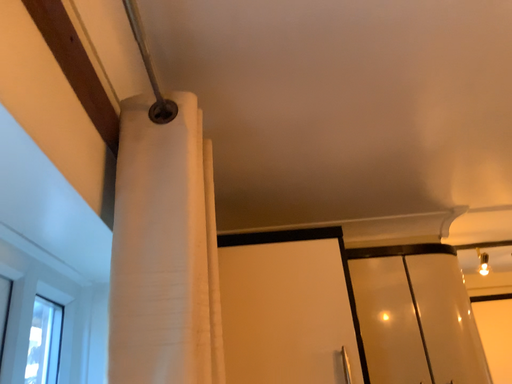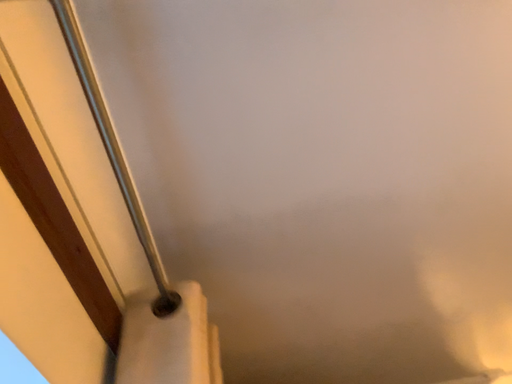
Question: How did the camera likely rotate when shooting the video?

Choices:
 (A) rotated downward
 (B) rotated upward

Answer: (B)